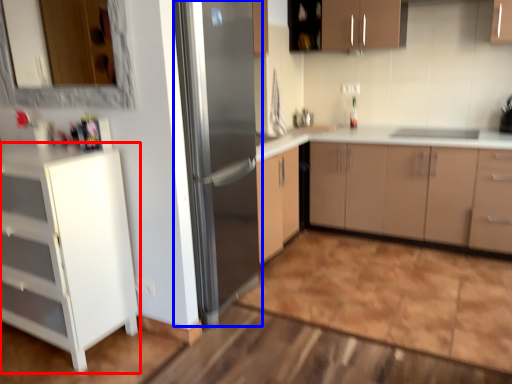
Question: Which object appears closest to the camera in this image, cabinetry (highlighted by a red box) or refrigerator (highlighted by a blue box)?

Choices:
 (A) cabinetry
 (B) refrigerator

Answer: (A)